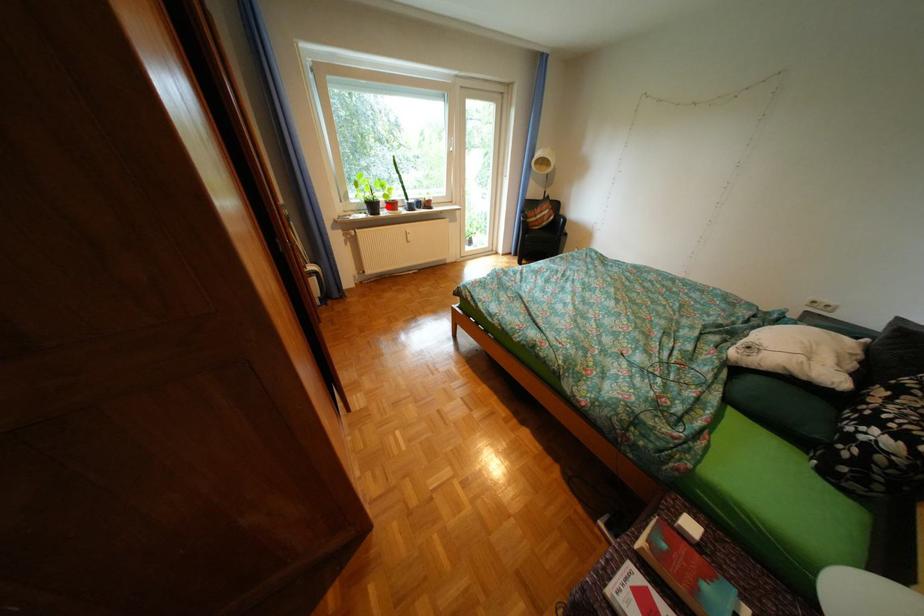
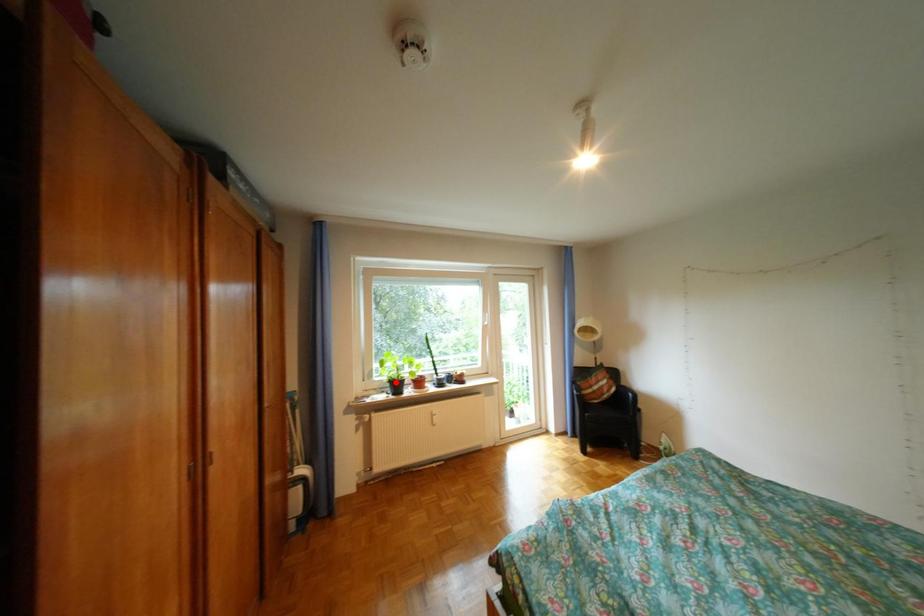
I am providing you with two images of the same scene from different viewpoints. A red point is marked on the first image and another point is marked on the second image. Does the point marked in image1 correspond to the same location as the one in image2?

No